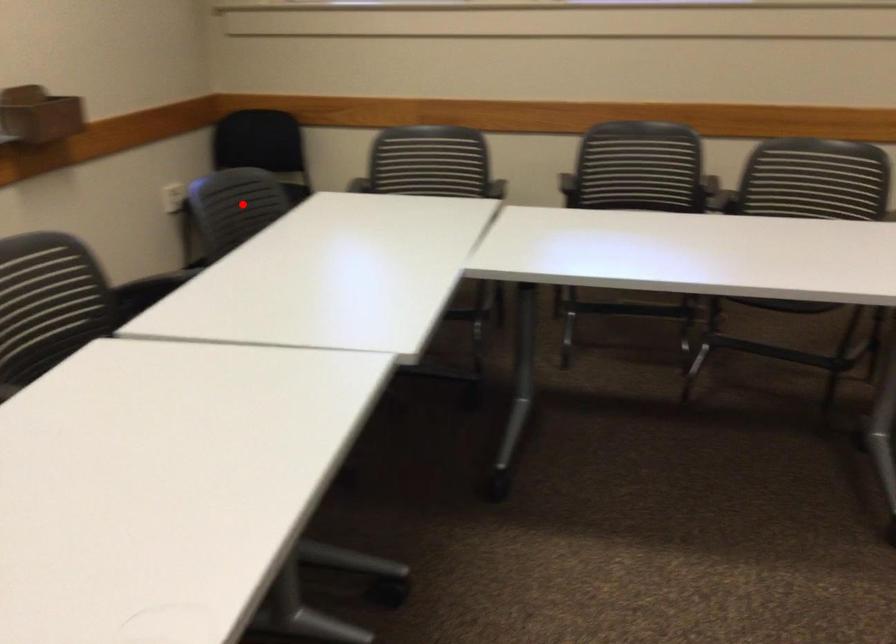
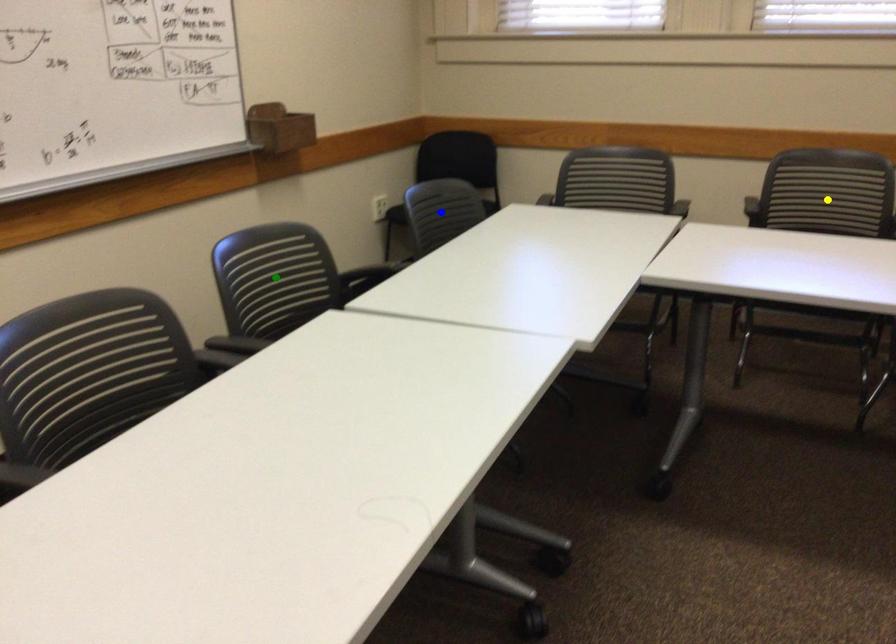
Question: I am providing you with two images of the same scene from different viewpoints. A red point is marked on the first image. You are given multiple points on the second image. Which spot in image 2 lines up with the point in image 1?

Choices:
 (A) blue point
 (B) yellow point
 (C) green point

Answer: (A)